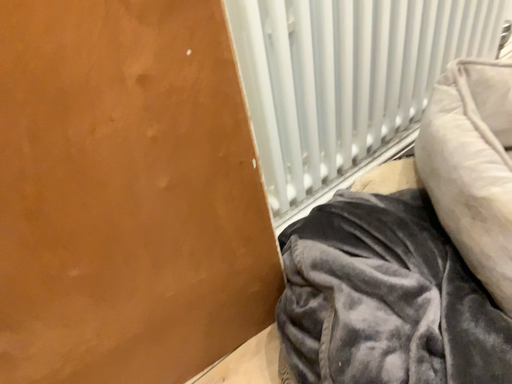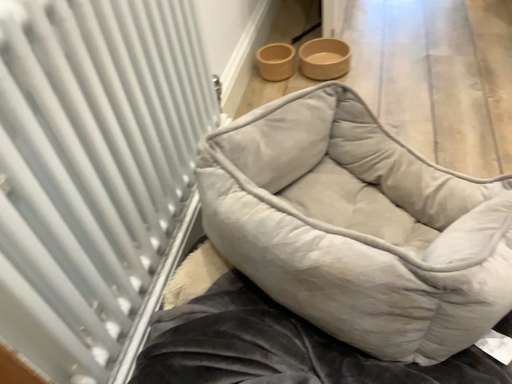
Question: Which way did the camera rotate in the video?

Choices:
 (A) rotated left
 (B) rotated right

Answer: (B)